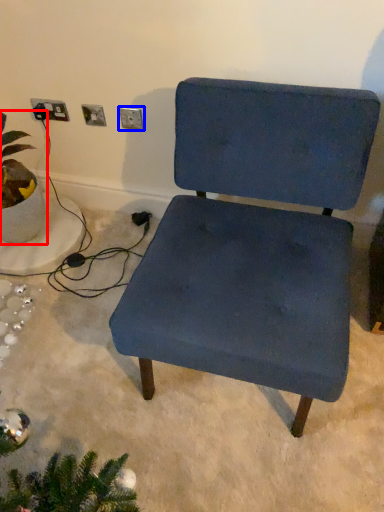
Question: Among these objects, which one is farthest to the camera, houseplant (highlighted by a red box) or electric outlet (highlighted by a blue box)?

Choices:
 (A) houseplant
 (B) electric outlet

Answer: (B)